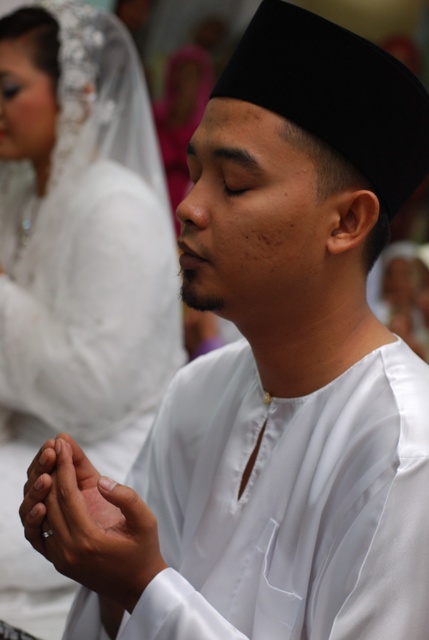
Is white satin veil at upper left taller than white satin hands at center?

Correct, white satin veil at upper left is much taller as white satin hands at center.

Who is more forward, (3, 442) or (132, 506)?

Point (132, 506)

The width and height of the screenshot is (429, 640). I want to click on white satin veil at upper left, so click(x=75, y=268).